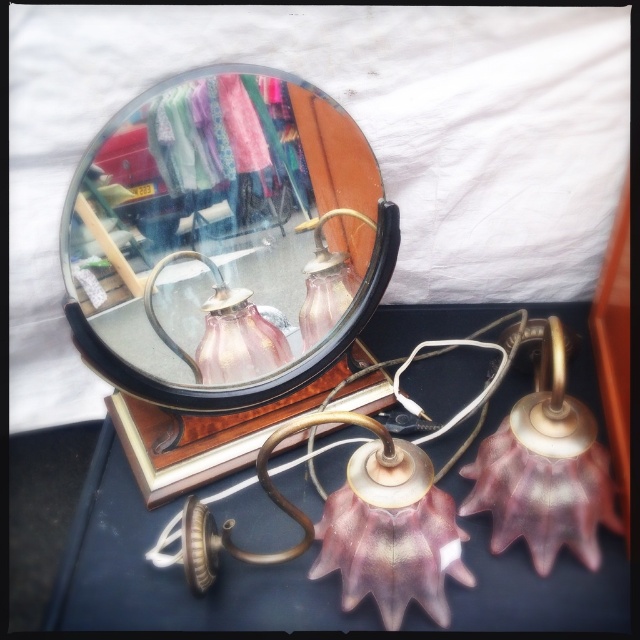
Can you confirm if pink glass lamp at center is positioned to the left of pink glass table lamp at center?

In fact, pink glass lamp at center is to the right of pink glass table lamp at center.

Does pink glass lamp at center appear on the right side of pink glass table lamp at center?

Correct, you'll find pink glass lamp at center to the right of pink glass table lamp at center.

Locate an element on the screen. This screenshot has width=640, height=640. pink glass lamp at center is located at coordinates (180, 576).

Find the location of a particular element. The width and height of the screenshot is (640, 640). pink glass lamp at center is located at coordinates (180, 576).

Describe the element at coordinates (224, 240) in the screenshot. I see `matte glass mirror at upper left` at that location.

How distant is matte glass mirror at upper left from pink glass table lamp at upper center?

matte glass mirror at upper left and pink glass table lamp at upper center are 4.70 inches apart.

The width and height of the screenshot is (640, 640). What are the coordinates of `matte glass mirror at upper left` in the screenshot? It's located at (224, 240).

Locate an element on the screen. The image size is (640, 640). matte glass mirror at upper left is located at coordinates (224, 240).

This screenshot has height=640, width=640. What do you see at coordinates (545, 468) in the screenshot?
I see `pink glass lampshade at lower right` at bounding box center [545, 468].

Can you confirm if pink glass lampshade at lower right is bigger than pink glass table lamp at center?

Indeed, pink glass lampshade at lower right has a larger size compared to pink glass table lamp at center.

Where is `pink glass lampshade at lower right`? This screenshot has height=640, width=640. pink glass lampshade at lower right is located at coordinates (545, 468).